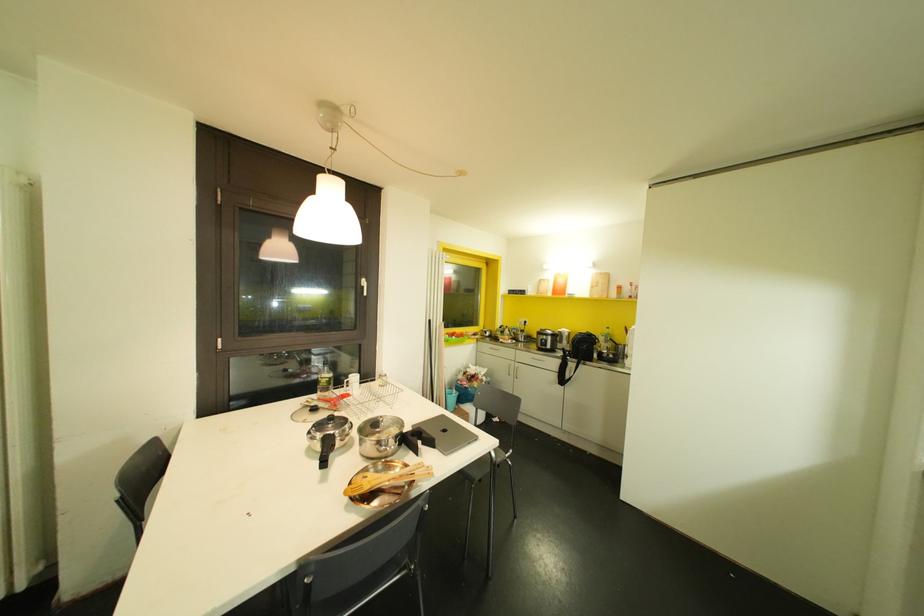
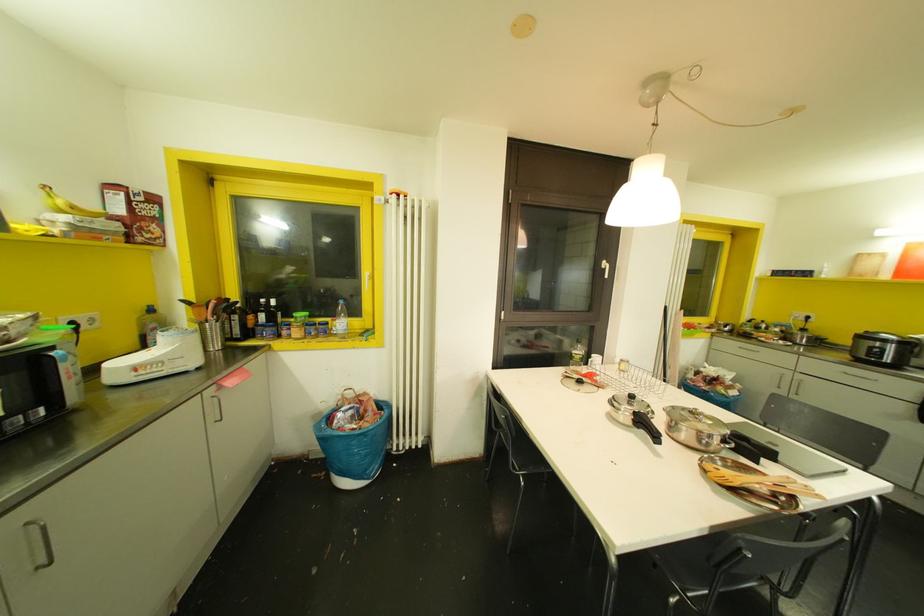
Where in the second image is the point corresponding to the point at 415,439 from the first image?

(745, 444)